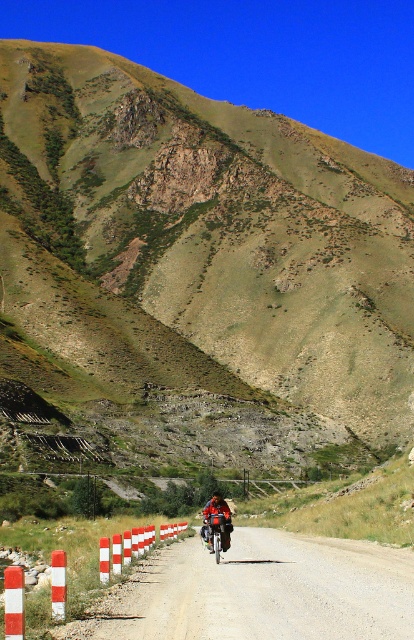
In the scene shown: Who is more distant from viewer, (65, 144) or (286, 541)?

Positioned behind is point (65, 144).

Which of these two, green grassy hillside at upper center or smooth asphalt road at center, stands shorter?

smooth asphalt road at center is shorter.

Is point (373, 285) closer to camera compared to point (274, 540)?

No, it is behind (274, 540).

Locate an element on the screen. green grassy hillside at upper center is located at coordinates (195, 268).

Find the location of a particular element. The height and width of the screenshot is (640, 414). smooth asphalt road at center is located at coordinates (259, 592).

The height and width of the screenshot is (640, 414). What do you see at coordinates (259, 592) in the screenshot? I see `smooth asphalt road at center` at bounding box center [259, 592].

Where is `smooth asphalt road at center`? This screenshot has height=640, width=414. smooth asphalt road at center is located at coordinates (259, 592).

Is green grassy hillside at upper center wider than red and white striped barrier at lower left?

Correct, the width of green grassy hillside at upper center exceeds that of red and white striped barrier at lower left.

Does green grassy hillside at upper center appear over red and white striped barrier at lower left?

Yes.

Does point (146, 221) come farther from viewer compared to point (98, 580)?

Yes, point (146, 221) is farther from viewer.

You are a GUI agent. You are given a task and a screenshot of the screen. Output one action in this format:
    pyautogui.click(x=<x>, y=<y>)
    Task: Click on the green grassy hillside at upper center
    The image size is (414, 640).
    Given the screenshot: What is the action you would take?
    [195, 268]